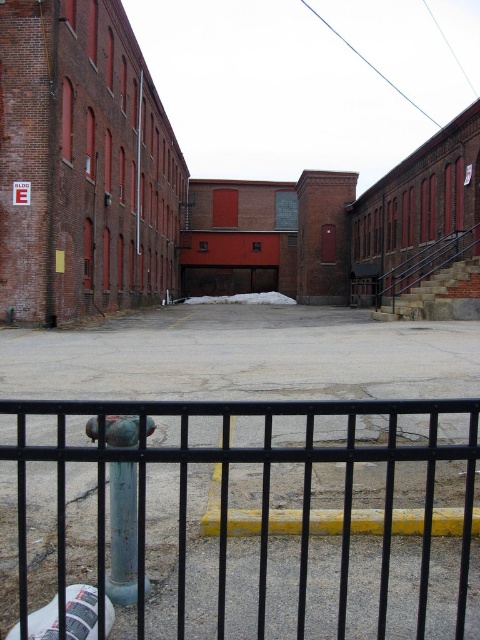
Question: Which point appears closest to the camera in this image?

Choices:
 (A) (127, 554)
 (B) (284, 412)

Answer: (B)

Question: Observing the image, what is the correct spatial positioning of black metal fence at lower center in reference to green patina hydrant at center?

Choices:
 (A) left
 (B) right

Answer: (B)

Question: Observing the image, what is the correct spatial positioning of black metal fence at lower center in reference to green patina hydrant at center?

Choices:
 (A) above
 (B) below

Answer: (B)

Question: Which object is farther from the camera taking this photo?

Choices:
 (A) black metal fence at lower center
 (B) green patina hydrant at center

Answer: (B)

Question: Is black metal fence at lower center wider than green patina hydrant at center?

Choices:
 (A) no
 (B) yes

Answer: (B)